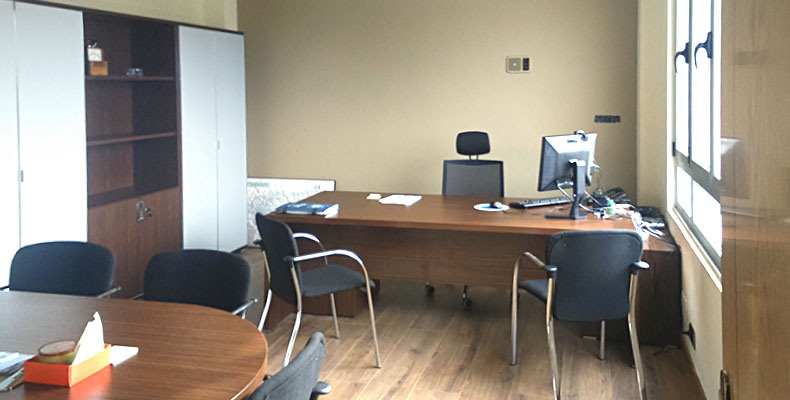
You are a GUI agent. You are given a task and a screenshot of the screen. Output one action in this format:
    pyautogui.click(x=<x>, y=<y>)
    Task: Click on the windows
    Image resolution: width=790 pixels, height=400 pixels.
    Given the screenshot: What is the action you would take?
    pyautogui.click(x=683, y=94), pyautogui.click(x=702, y=99), pyautogui.click(x=702, y=206), pyautogui.click(x=675, y=185)